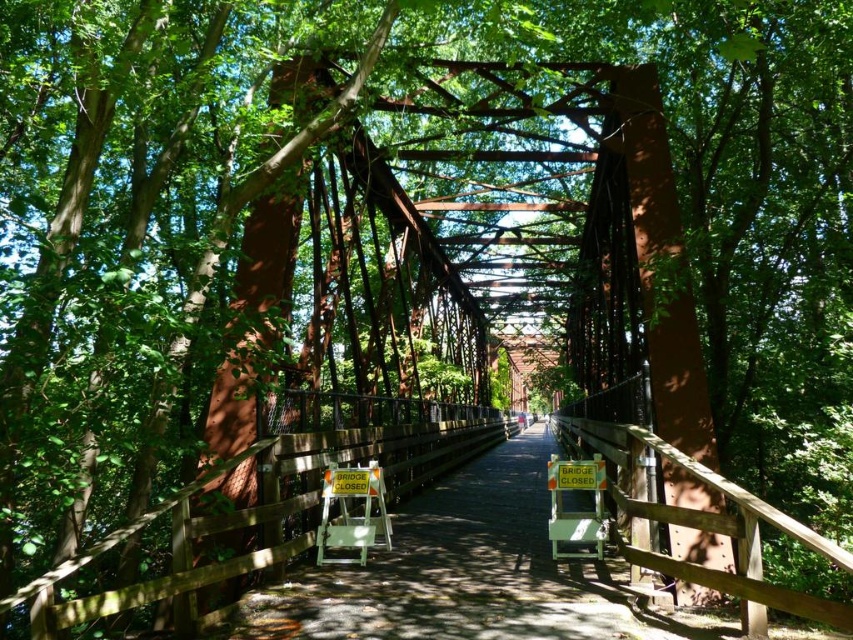
Who is positioned more to the left, orange plastic chair at center or orange plastic sign at center?

orange plastic chair at center

What do you see at coordinates (351, 515) in the screenshot? I see `orange plastic chair at center` at bounding box center [351, 515].

This screenshot has width=853, height=640. In order to click on orange plastic chair at center in this screenshot , I will do `click(351, 515)`.

Locate an element on the screen. orange plastic chair at center is located at coordinates (351, 515).